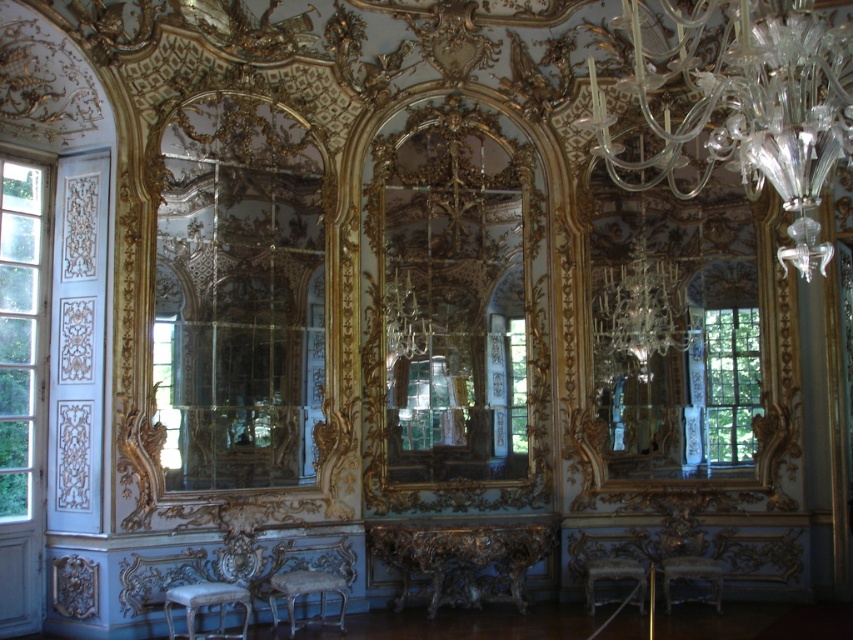
Question: Does gold/gilded mirror at center have a greater width compared to silver metallic chair at lower left?

Choices:
 (A) no
 (B) yes

Answer: (B)

Question: Among these points, which one is farthest from the camera?

Choices:
 (A) (189, 632)
 (B) (291, 572)
 (C) (193, 609)

Answer: (B)

Question: Which of the following is the closest to the observer?

Choices:
 (A) wooden polished stool at lower center
 (B) clear glass mirror at center
 (C) white fabric stool at center

Answer: (B)

Question: Can you confirm if silver metallic chair at lower center is positioned to the right of silver metallic chair at lower left?

Choices:
 (A) yes
 (B) no

Answer: (A)

Question: Which point is farther to the camera?

Choices:
 (A) (622, 1)
 (B) (686, 572)
 (C) (201, 602)
 (D) (209, 634)

Answer: (B)

Question: Is gold/gilded mirror at center smaller than wooden polished stool at lower center?

Choices:
 (A) yes
 (B) no

Answer: (B)